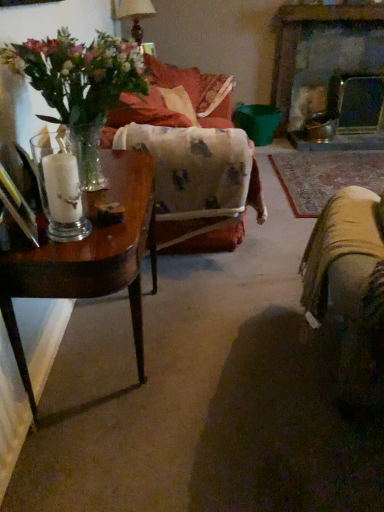
Question: Is the position of clear glass candle at left less distant than that of velvet orange couch at center, which is the 1th couch in back-to-front order?

Choices:
 (A) no
 (B) yes

Answer: (B)

Question: From a real-world perspective, is clear glass candle at left physically below velvet orange couch at center, which is the 1th couch in back-to-front order?

Choices:
 (A) no
 (B) yes

Answer: (A)

Question: Could you tell me if clear glass candle at left is turned towards velvet orange couch at center, which is the 1th couch in back-to-front order?

Choices:
 (A) no
 (B) yes

Answer: (A)

Question: From a real-world perspective, does clear glass candle at left stand above velvet orange couch at center, the 2th couch viewed from the front?

Choices:
 (A) no
 (B) yes

Answer: (B)

Question: Is the surface of clear glass candle at left in direct contact with velvet orange couch at center, the 2th couch viewed from the front?

Choices:
 (A) yes
 (B) no

Answer: (B)

Question: From the image's perspective, is clear glass candle at left above or below wooden table at left?

Choices:
 (A) above
 (B) below

Answer: (A)

Question: Is point (59, 154) closer or farther from the camera than point (120, 184)?

Choices:
 (A) closer
 (B) farther

Answer: (A)

Question: From a real-world perspective, is clear glass candle at left physically located above or below wooden table at left?

Choices:
 (A) above
 (B) below

Answer: (A)

Question: In the image, is clear glass candle at left on the left side or the right side of wooden table at left?

Choices:
 (A) left
 (B) right

Answer: (A)

Question: In the image, is clear glass candle at left on the left side or the right side of smooth stone fireplace at upper right?

Choices:
 (A) left
 (B) right

Answer: (A)

Question: Is clear glass candle at left wider or thinner than smooth stone fireplace at upper right?

Choices:
 (A) thin
 (B) wide

Answer: (A)

Question: From the image's perspective, relative to smooth stone fireplace at upper right, is clear glass candle at left above or below?

Choices:
 (A) below
 (B) above

Answer: (A)

Question: Is clear glass candle at left situated inside smooth stone fireplace at upper right or outside?

Choices:
 (A) inside
 (B) outside

Answer: (B)

Question: From the image's perspective, relative to velvet orange couch at center, which is the 1th couch in back-to-front order, is clear glass candle at left above or below?

Choices:
 (A) below
 (B) above

Answer: (A)

Question: In terms of width, does clear glass candle at left look wider or thinner when compared to velvet orange couch at center, which is the 1th couch in back-to-front order?

Choices:
 (A) wide
 (B) thin

Answer: (B)